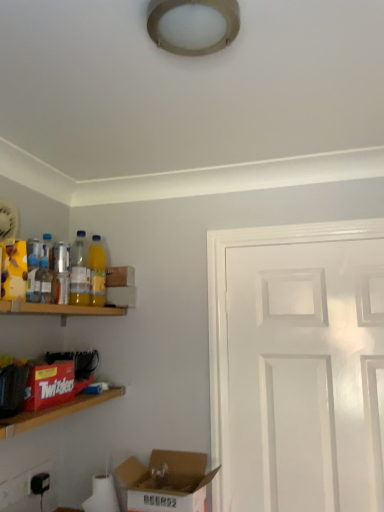
Identify the location of translucent plastic bottle at left, which is the 2th bottle from front to back. The width and height of the screenshot is (384, 512). (44, 282).

Measure the distance between point (44, 415) and camera.

The distance of point (44, 415) from camera is 4.10 feet.

The height and width of the screenshot is (512, 384). What do you see at coordinates (54, 412) in the screenshot? I see `wooden twizzlers box at left, the 2th shelf viewed from the top` at bounding box center [54, 412].

The width and height of the screenshot is (384, 512). Describe the element at coordinates (97, 272) in the screenshot. I see `yellow translucent bottle at left, the 4th bottle when ordered from front to back` at that location.

Locate an element on the screen. The height and width of the screenshot is (512, 384). translucent plastic bottle at left, which is the 4th bottle in back-to-front order is located at coordinates (33, 269).

In order to face translucent plastic bottle at left, which is the 4th bottle in back-to-front order, should I rotate leftwards or rightwards?

Turn left approximately 20.144 degrees to face it.

What are the coordinates of `cardboard box at lower left, which is counted as the 2th box, starting from the top` in the screenshot? It's located at (167, 481).

What's the angular difference between wooden shelf at left, placed as the first shelf when sorted from top to bottom, and white plastic electric outlet at lower left, positioned as the 1th electric outlet in left-to-right order,'s facing directions?

0.547 degrees.

From a real-world perspective, is wooden shelf at left, the second shelf in the bottom-to-top sequence, on top of white plastic electric outlet at lower left, positioned as the 1th electric outlet in left-to-right order?

Yes, from a real-world perspective, wooden shelf at left, the second shelf in the bottom-to-top sequence, is on top of white plastic electric outlet at lower left, positioned as the 1th electric outlet in left-to-right order.

Which of these two, wooden shelf at left, the second shelf in the bottom-to-top sequence, or white plastic electric outlet at lower left, the second electric outlet positioned from the right, stands shorter?

Standing shorter between the two is wooden shelf at left, the second shelf in the bottom-to-top sequence.

At what (x,y) coordinates should I click in order to perform the action: click on shelf that is the 1st one when counting rightward from the white plastic electric outlet at lower left, positioned as the 1th electric outlet in left-to-right order. Please return your answer as a coordinate pair (x, y). Image resolution: width=384 pixels, height=512 pixels. Looking at the image, I should click on (58, 309).

What are the coordinates of `door above the cardboard box at lower left, which is counted as the 2th box, starting from the top (from a real-world perspective)` in the screenshot? It's located at (300, 368).

Is white glossy door at right further to camera compared to cardboard box at lower left, arranged as the second box when viewed from the left?

Yes, white glossy door at right is further from the camera.

In the scene shown: From a real-world perspective, is white glossy door at right positioned over cardboard box at lower left, which is counted as the 2th box, starting from the top, based on gravity?

Correct, in the physical world, white glossy door at right is higher than cardboard box at lower left, which is counted as the 2th box, starting from the top.

Is white glossy door at right looking in the opposite direction of cardboard box at lower left, the 1th box from the bottom?

No, white glossy door at right is not facing the opposite direction of cardboard box at lower left, the 1th box from the bottom.

Considering the sizes of objects black plastic electric outlet at lower left, which is counted as the second electric outlet, starting from the left, and yellow translucent bottle at left, the 4th bottle when ordered from front to back, in the image provided, who is bigger, black plastic electric outlet at lower left, which is counted as the second electric outlet, starting from the left, or yellow translucent bottle at left, the 4th bottle when ordered from front to back,?

With larger size is yellow translucent bottle at left, the 4th bottle when ordered from front to back.

Considering the sizes of objects black plastic electric outlet at lower left, the 2th electric outlet when ordered from front to back, and yellow translucent bottle at left, the 4th bottle when ordered from front to back, in the image provided, who is wider, black plastic electric outlet at lower left, the 2th electric outlet when ordered from front to back, or yellow translucent bottle at left, the 4th bottle when ordered from front to back,?

yellow translucent bottle at left, the 4th bottle when ordered from front to back.

Considering the sizes of black plastic electric outlet at lower left, the 1th electric outlet when ordered from right to left, and yellow translucent bottle at left, the 4th bottle when ordered from front to back, in the image, is black plastic electric outlet at lower left, the 1th electric outlet when ordered from right to left, taller or shorter than yellow translucent bottle at left, the 4th bottle when ordered from front to back,?

Considering their sizes, black plastic electric outlet at lower left, the 1th electric outlet when ordered from right to left, has less height than yellow translucent bottle at left, the 4th bottle when ordered from front to back.

Measure the distance from black plastic electric outlet at lower left, positioned as the first electric outlet in back-to-front order, to yellow translucent bottle at left, the 4th bottle when ordered from front to back.

black plastic electric outlet at lower left, positioned as the first electric outlet in back-to-front order, is 28.96 inches from yellow translucent bottle at left, the 4th bottle when ordered from front to back.

Is translucent plastic bottle at left, which is the 4th bottle in back-to-front order, wider than white glossy door at right?

No, translucent plastic bottle at left, which is the 4th bottle in back-to-front order, is not wider than white glossy door at right.

Which is behind, point (32, 281) or point (305, 348)?

Positioned behind is point (305, 348).

Is white glossy door at right at the back of translucent plastic bottle at left, which is the first bottle in front-to-back order?

That's not correct — translucent plastic bottle at left, which is the first bottle in front-to-back order, is not looking away from white glossy door at right.

Find the location of a particular element. Image resolution: width=384 pixels, height=512 pixels. door that appears below the translucent plastic bottle at left, which is the 4th bottle in back-to-front order (from a real-world perspective) is located at coordinates (300, 368).

Does cardboard box at lower left, the 1th box from the bottom, lie in front of translucent plastic bottle at left, which is the 4th bottle in back-to-front order?

Yes.

Starting from the translucent plastic bottle at left, which is the 4th bottle in back-to-front order, which box is the 2nd one in front? Please provide its 2D coordinates.

[(167, 481)]

Is cardboard box at lower left, arranged as the second box when viewed from the left, placed right next to translucent plastic bottle at left, which is the 4th bottle in back-to-front order?

No, cardboard box at lower left, arranged as the second box when viewed from the left, is not making contact with translucent plastic bottle at left, which is the 4th bottle in back-to-front order.

From the picture: Between cardboard box at lower left, the 1th box from the bottom, and translucent plastic bottle at left, which is the first bottle in front-to-back order, which one has larger width?

With larger width is cardboard box at lower left, the 1th box from the bottom.

Can we say wooden twizzlers box at left, the 2th shelf viewed from the top, lies outside cardboard box at lower left, arranged as the second box when viewed from the left?

Yes, wooden twizzlers box at left, the 2th shelf viewed from the top, is outside of cardboard box at lower left, arranged as the second box when viewed from the left.

Is the depth of wooden twizzlers box at left, which is the 1th shelf in bottom-to-top order, greater than that of cardboard box at lower left, the 1th box from the bottom?

No, wooden twizzlers box at left, which is the 1th shelf in bottom-to-top order, is closer to the camera.

Is point (116, 390) closer to viewer compared to point (124, 465)?

No, (116, 390) is behind (124, 465).

Is wooden shelf at left, placed as the first shelf when sorted from top to bottom, located outside black plastic electric outlet at lower left, which is counted as the second electric outlet, starting from the left?

That's correct, wooden shelf at left, placed as the first shelf when sorted from top to bottom, is outside of black plastic electric outlet at lower left, which is counted as the second electric outlet, starting from the left.

Is wooden shelf at left, the second shelf in the bottom-to-top sequence, aimed at black plastic electric outlet at lower left, the 2th electric outlet when ordered from front to back?

No, wooden shelf at left, the second shelf in the bottom-to-top sequence, is not oriented towards black plastic electric outlet at lower left, the 2th electric outlet when ordered from front to back.

From the image's perspective, would you say wooden shelf at left, the second shelf in the bottom-to-top sequence, is positioned over black plastic electric outlet at lower left, which is counted as the second electric outlet, starting from the left?

Yes.

Is wooden shelf at left, the second shelf in the bottom-to-top sequence, in contact with black plastic electric outlet at lower left, positioned as the first electric outlet in back-to-front order?

wooden shelf at left, the second shelf in the bottom-to-top sequence, and black plastic electric outlet at lower left, positioned as the first electric outlet in back-to-front order, are clearly separated.

Where is `shelf that is the 1st one when counting forward from the white plastic electric outlet at lower left, the second electric outlet positioned from the right`? This screenshot has width=384, height=512. shelf that is the 1st one when counting forward from the white plastic electric outlet at lower left, the second electric outlet positioned from the right is located at coordinates (58, 309).

I want to click on door above the cardboard box at lower left, which is counted as the 2th box, starting from the top (from a real-world perspective), so [300, 368].

From the image, which object appears to be farther from wooden shelf at left, the second shelf in the bottom-to-top sequence, white glossy door at right or yellow translucent bottle at left, which appears as the first bottle when viewed from the back?

white glossy door at right is further to wooden shelf at left, the second shelf in the bottom-to-top sequence.

Considering their positions, is wooden shelf at left, the second shelf in the bottom-to-top sequence, positioned closer to wooden twizzlers box at left, the 2th shelf viewed from the top, than white plastic electric outlet at lower left, positioned as the 1th electric outlet in left-to-right order?

wooden shelf at left, the second shelf in the bottom-to-top sequence, lies closer to wooden twizzlers box at left, the 2th shelf viewed from the top, than the other object.

Which object lies further to the anchor point cardboard box at lower left, which is counted as the 2th box, starting from the top, translucent plastic bottle at left, which is the 4th bottle in back-to-front order, or white glossy door at right?

Among the two, translucent plastic bottle at left, which is the 4th bottle in back-to-front order, is located further to cardboard box at lower left, which is counted as the 2th box, starting from the top.

Which object lies nearer to the anchor point yellow translucent bottle at left, the 4th bottle when ordered from front to back, translucent plastic bottle at left, placed as the 2th bottle when sorted from back to front, or black plastic electric outlet at lower left, positioned as the first electric outlet in back-to-front order?

translucent plastic bottle at left, placed as the 2th bottle when sorted from back to front.

Based on their spatial positions, is wooden twizzlers box at left, the 2th shelf viewed from the top, or translucent plastic bottle at left, placed as the 2th bottle when sorted from back to front, further from white plastic electric outlet at lower left, arranged as the 1th electric outlet when viewed from the front?

Among the two, translucent plastic bottle at left, placed as the 2th bottle when sorted from back to front, is located further to white plastic electric outlet at lower left, arranged as the 1th electric outlet when viewed from the front.

Considering their positions, is yellow translucent bottle at left, the 4th bottle when ordered from front to back, positioned further to translucent plastic bottle at left, which is the 4th bottle in back-to-front order, than cardboard box at lower left, the first box positioned from the right?

Result: cardboard box at lower left, the first box positioned from the right, lies further to translucent plastic bottle at left, which is the 4th bottle in back-to-front order, than the other object.

Based on their spatial positions, is yellow translucent bottle at left, which appears as the first bottle when viewed from the back, or wooden twizzlers box at left, which is the 1th shelf in bottom-to-top order, closer to wooden shelf at left, placed as the first shelf when sorted from top to bottom?

Among the two, yellow translucent bottle at left, which appears as the first bottle when viewed from the back, is located nearer to wooden shelf at left, placed as the first shelf when sorted from top to bottom.

Looking at this image, looking at the image, which one is located further to black plastic electric outlet at lower left, which is counted as the second electric outlet, starting from the left, white plastic electric outlet at lower left, positioned as the 1th electric outlet in left-to-right order, or wooden shelf at left, the second shelf in the bottom-to-top sequence?

wooden shelf at left, the second shelf in the bottom-to-top sequence, lies further to black plastic electric outlet at lower left, which is counted as the second electric outlet, starting from the left, than the other object.

At what (x,y) coordinates should I click in order to perform the action: click on shelf between matte red twizzlers box at lower left, acting as the second box starting from the right, and white glossy door at right. Please return your answer as a coordinate pair (x, y). Looking at the image, I should click on (x=54, y=412).

Identify the location of shelf between matte red twizzlers box at lower left, which is the first box from top to bottom, and white plastic electric outlet at lower left, the second electric outlet positioned from the right, in the vertical direction. The image size is (384, 512). (54, 412).

In order to click on box between wooden twizzlers box at left, the 2th shelf viewed from the top, and white glossy door at right in this screenshot , I will do `click(167, 481)`.

Identify the location of box between white plastic electric outlet at lower left, which is the second electric outlet from back to front, and cardboard box at lower left, the first box positioned from the right, in the horizontal direction. This screenshot has height=512, width=384. (49, 385).